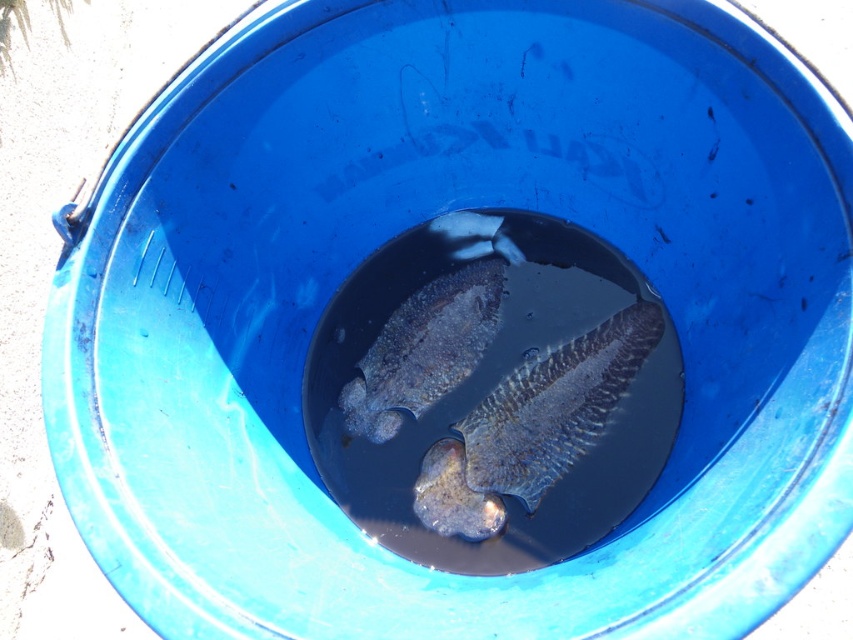
Question: Can you confirm if dark gray textured fish at center is bigger than smooth grayish fish at center?

Choices:
 (A) yes
 (B) no

Answer: (A)

Question: Does dark gray textured fish at center appear on the right side of smooth grayish fish at center?

Choices:
 (A) no
 (B) yes

Answer: (B)

Question: Which point is closer to the camera taking this photo?

Choices:
 (A) (422, 291)
 (B) (647, 348)

Answer: (B)

Question: Is dark gray textured fish at center behind smooth grayish fish at center?

Choices:
 (A) yes
 (B) no

Answer: (B)